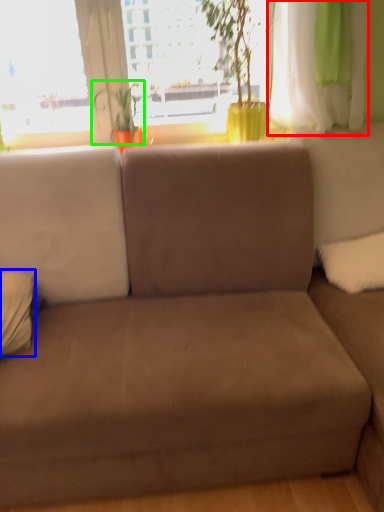
Question: Which is nearer to the curtain (highlighted by a red box)? pillow (highlighted by a blue box) or plant (highlighted by a green box).

Choices:
 (A) pillow
 (B) plant

Answer: (B)